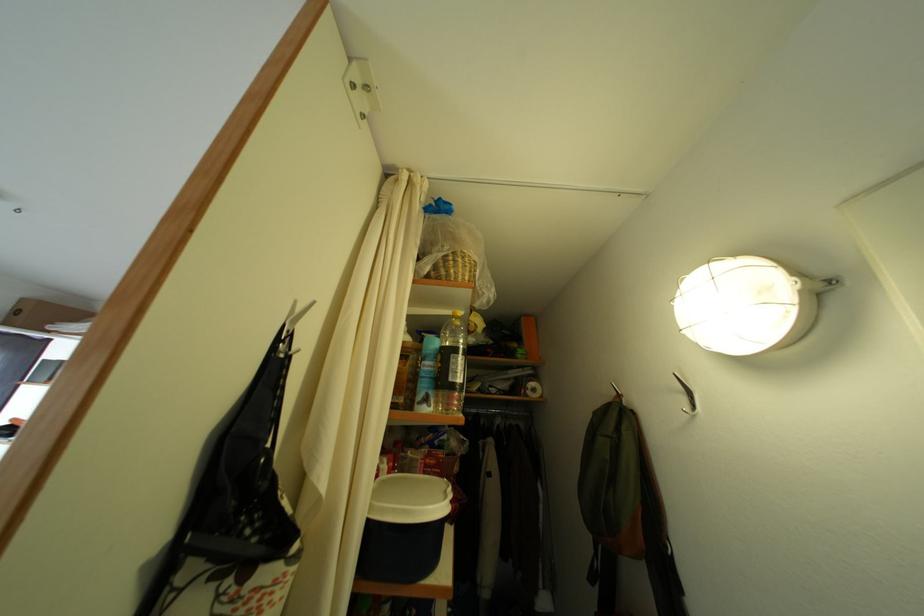
This screenshot has width=924, height=616. I want to click on white container lid, so click(408, 498).